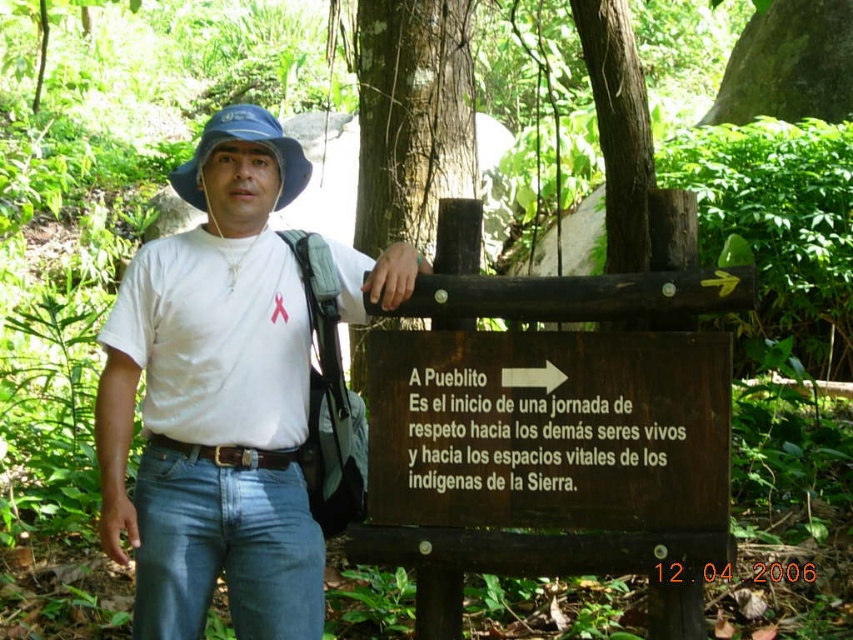
Question: Which of the following is the closest to the observer?

Choices:
 (A) white cotton shirt at center
 (B) smooth brown tree trunk at center

Answer: (A)

Question: Can you confirm if brown wooden sign at center is thinner than white matte t-shirt at center?

Choices:
 (A) yes
 (B) no

Answer: (B)

Question: Does white matte t-shirt at center have a smaller size compared to smooth brown tree trunk at center?

Choices:
 (A) yes
 (B) no

Answer: (A)

Question: Which point is farther to the camera?

Choices:
 (A) blue fabric hat at upper center
 (B) smooth brown tree trunk at center

Answer: (B)

Question: Estimate the real-world distances between objects in this image. Which object is closer to the brown wooden sign at center?

Choices:
 (A) blue fabric hat at upper center
 (B) white matte t-shirt at center
 (C) smooth brown tree trunk at upper center

Answer: (B)

Question: Is brown wooden sign at center positioned at the back of blue fabric hat at upper center?

Choices:
 (A) no
 (B) yes

Answer: (A)